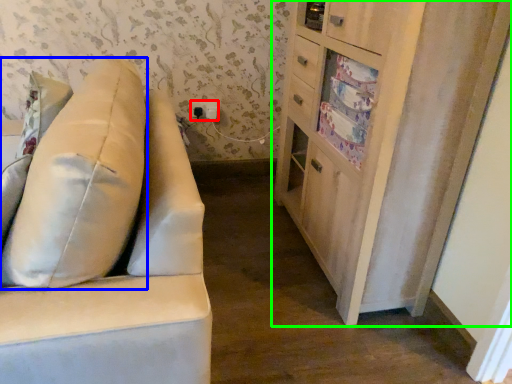
Question: Which object is positioned closest to electric outlet (highlighted by a red box)? Select from throw pillow (highlighted by a blue box) and cabinetry (highlighted by a green box).

Choices:
 (A) throw pillow
 (B) cabinetry

Answer: (B)